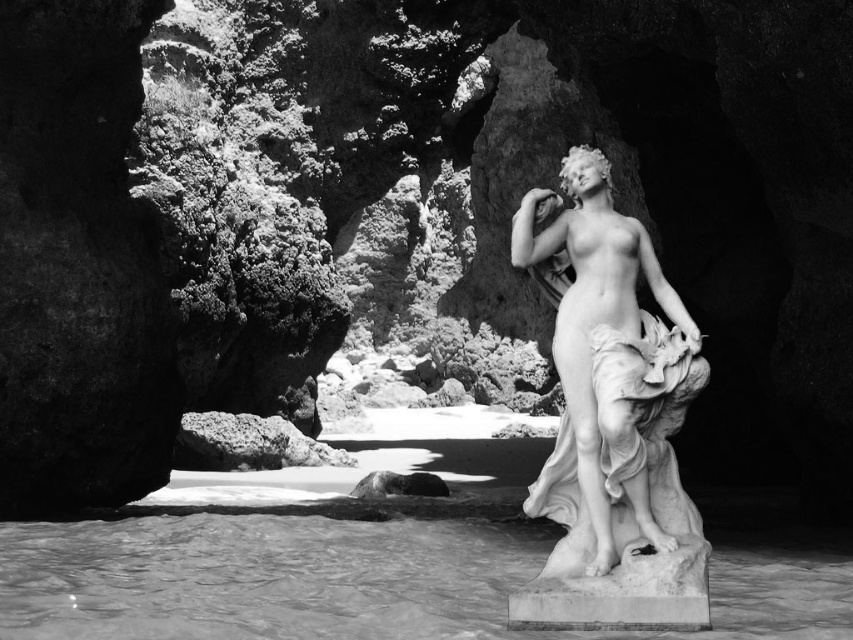
You are an art conservator examining this black and white photograph. You notice the translucent white water at lower center and the white marble statue at center. Which object is closer to the viewer?

The translucent white water at lower center is closer to the viewer than the white marble statue at center because it is positioned in front of it.

You are a photographer trying to capture the statue and the water in the scene. Since you want to ensure both the white marble statue at center and the translucent white water at lower center are visible in your shot, which object should you focus on first to account for their sizes?

The translucent white water at lower center is wider than the white marble statue at center, so you should focus on the translucent white water at lower center first to ensure its entire width is captured in the frame.

You are standing in front of the statue and want to take a photo. You notice two points marked in the image. The first point is at coordinates point (828, 602) and the second is at point (560, 512). Which point is closer to your camera?

Point (828, 602) is further to the camera than point (560, 512), so the second point is closer to your camera.